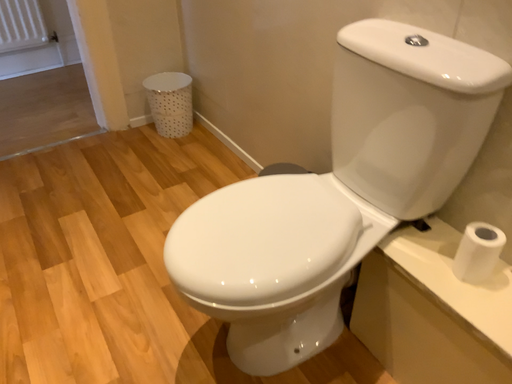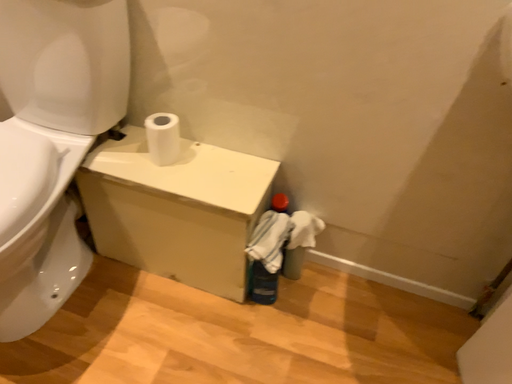
Question: How did the camera likely rotate when shooting the video?

Choices:
 (A) rotated right
 (B) rotated left

Answer: (A)